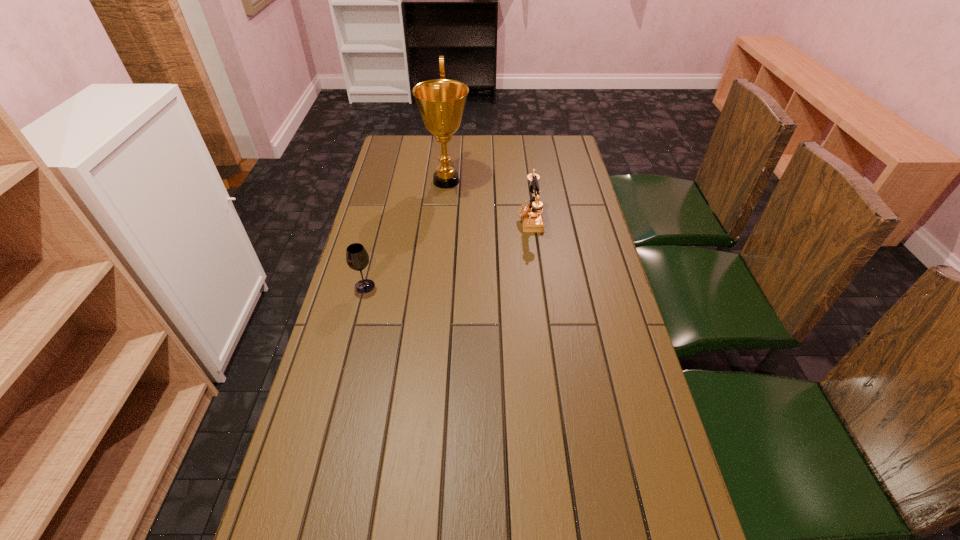
Locate an element on the screen. The height and width of the screenshot is (540, 960). the second object from right to left is located at coordinates (441, 102).

This screenshot has height=540, width=960. Find the location of `the farthest object`. the farthest object is located at coordinates (441, 102).

Locate an element on the screen. The image size is (960, 540). the second farthest object is located at coordinates (532, 220).

Where is `the rightmost object`? the rightmost object is located at coordinates (532, 220).

Find the location of a particular element. Image resolution: width=960 pixels, height=540 pixels. the nearest object is located at coordinates (357, 258).

Find the location of a particular element. The image size is (960, 540). wineglass is located at coordinates (357, 258).

Locate an element on the screen. free location located on the front view with handles of the tallest object is located at coordinates (534, 181).

Locate an element on the screen. The image size is (960, 540). free space located 0.110m on the dial of the telephone is located at coordinates (486, 219).

You are a GUI agent. You are given a task and a screenshot of the screen. Output one action in this format:
    pyautogui.click(x=<x>, y=<y>)
    Task: Click on the vacant space located on the dial of the telephone
    
    Given the screenshot: What is the action you would take?
    pyautogui.click(x=447, y=219)

You are a GUI agent. You are given a task and a screenshot of the screen. Output one action in this format:
    pyautogui.click(x=<x>, y=<y>)
    Task: Click on the vacant area situated 0.060m on the dial of the telephone
    The image size is (960, 540).
    Given the screenshot: What is the action you would take?
    pyautogui.click(x=500, y=219)